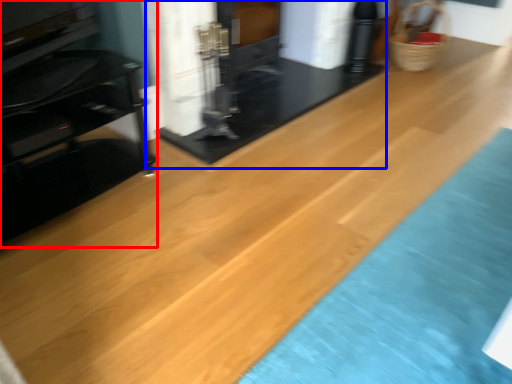
Question: Among these objects, which one is nearest to the camera, furniture (highlighted by a red box) or fireplace (highlighted by a blue box)?

Choices:
 (A) furniture
 (B) fireplace

Answer: (A)